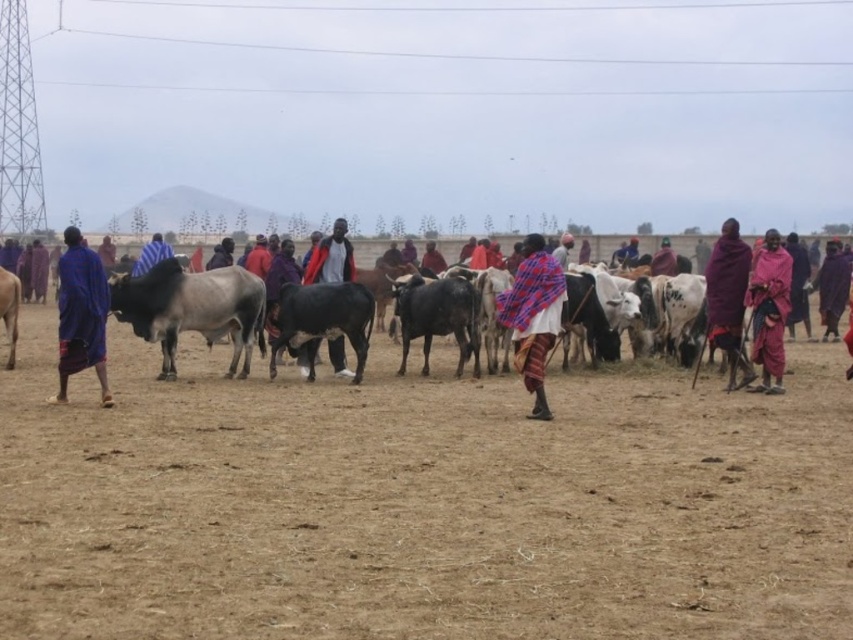
You are a photographer trying to capture the black glossy bull at center and the white speckled hide at center in the same frame. Which object should you focus on first to ensure both are in the shot?

The black glossy bull at center is below the white speckled hide at center, so you should focus on the white speckled hide at center first to ensure both are in the shot.

You are a photographer trying to capture the scene of the shiny black bull at center and the dark blue fabric at center. Based on their sizes, which one would appear larger in your photo?

The dark blue fabric at center appears larger in the photo because it is taller than the shiny black bull at center.